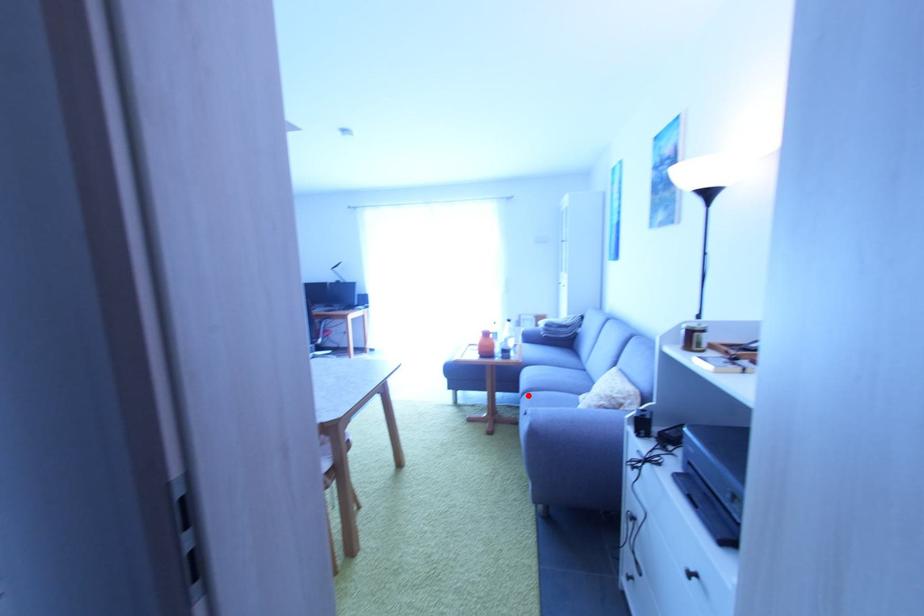
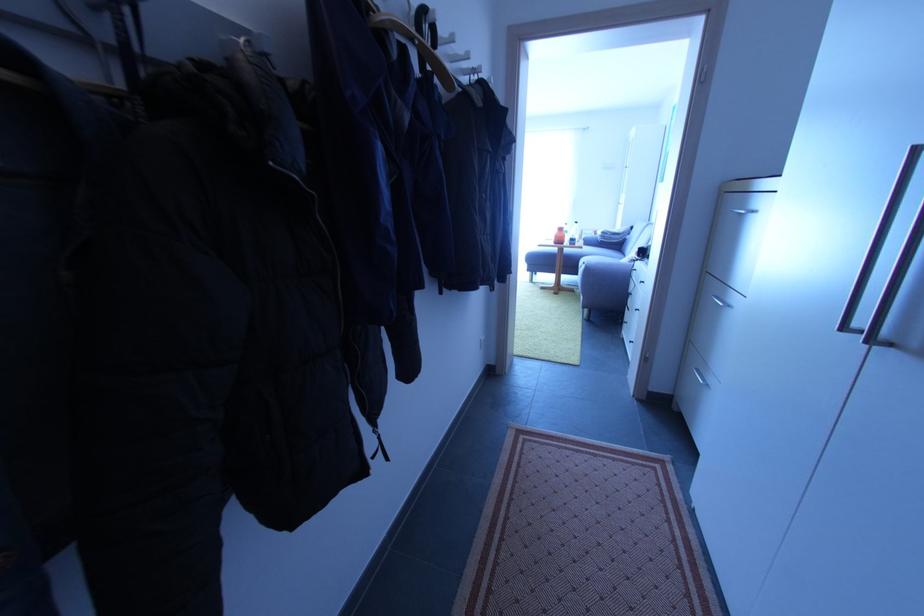
Question: I am providing you with two images of the same scene from different viewpoints. A red point is marked on the first image. Is the red point's position out of view in image 2?

Choices:
 (A) Yes
 (B) No

Answer: (B)